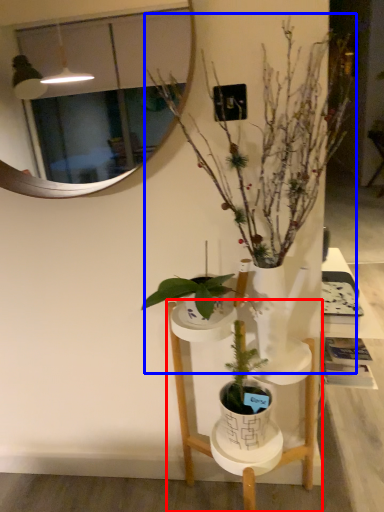
Question: Which point is closer to the camera, furniture (highlighted by a red box) or houseplant (highlighted by a blue box)?

Choices:
 (A) furniture
 (B) houseplant

Answer: (B)